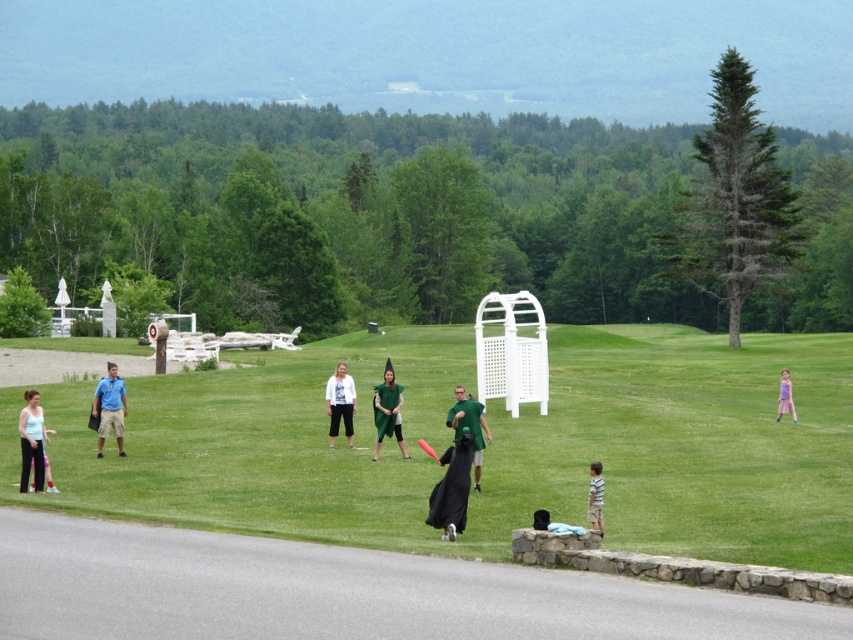
You are standing at the camera position looking at the park scene. There is a point marked at coordinates point [463,460]. Can you reach this point by walking straight ahead without deviating from your path?

The point [463,460] is 19.94 meters away from the camera. Since there is a paved pathway curving gently from the bottom left corner towards the center of the frame, you can walk straight ahead towards the point as it lies along the path.

You are a photographer positioned at the stone bench with a black object. You need to take a photo that includes both the green fabric dress at center and the green matte dress at center. Given that your camera has a maximum focus range of 30 meters, will you be able to capture both subjects in focus?

The distance between the green fabric dress at center and the green matte dress at center is 31.69 meters, which exceeds the camera maximum focus range of 30 meters. Therefore, you cannot capture both subjects in focus.